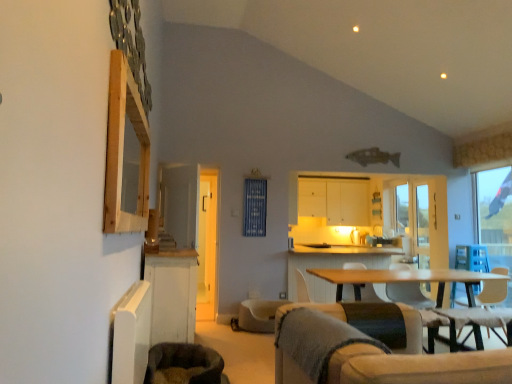
Question: Is white wood cabinet at lower left, positioned as the second cabinetry in top-to-bottom order, turned away from light brown wooden table at center?

Choices:
 (A) yes
 (B) no

Answer: (B)

Question: Would you say white wood cabinet at lower left, the 1th cabinetry positioned from the bottom, is outside light brown wooden table at center?

Choices:
 (A) no
 (B) yes

Answer: (B)

Question: Can you confirm if white wood cabinet at lower left, the first cabinetry positioned from the front, is shorter than light brown wooden table at center?

Choices:
 (A) yes
 (B) no

Answer: (B)

Question: Can you confirm if white wood cabinet at lower left, the 2th cabinetry viewed from the back, is positioned to the right of light brown wooden table at center?

Choices:
 (A) no
 (B) yes

Answer: (A)

Question: Does white wood cabinet at lower left, the 1th cabinetry positioned from the bottom, have a greater width compared to light brown wooden table at center?

Choices:
 (A) no
 (B) yes

Answer: (A)

Question: In the image, is transparent glass window at right on the left side or the right side of white matte cabinet at upper center, which is the first cabinetry from back to front?

Choices:
 (A) right
 (B) left

Answer: (A)

Question: In the image, is transparent glass window at right positioned in front of or behind white matte cabinet at upper center, which appears as the first cabinetry when viewed from the top?

Choices:
 (A) behind
 (B) front

Answer: (B)

Question: Does point (494, 231) appear closer or farther from the camera than point (348, 198)?

Choices:
 (A) closer
 (B) farther

Answer: (B)

Question: Looking at their shapes, would you say transparent glass window at right is wider or thinner than white matte cabinet at upper center, placed as the second cabinetry when sorted from front to back?

Choices:
 (A) wide
 (B) thin

Answer: (B)

Question: Based on their sizes in the image, would you say white fabric armchair at center is bigger or smaller than blue fabric curtain at center?

Choices:
 (A) big
 (B) small

Answer: (A)

Question: Is point (297, 294) closer or farther from the camera than point (249, 220)?

Choices:
 (A) closer
 (B) farther

Answer: (A)

Question: From the image's perspective, is white fabric armchair at center above or below blue fabric curtain at center?

Choices:
 (A) below
 (B) above

Answer: (A)

Question: From a real-world perspective, is white fabric armchair at center positioned above or below blue fabric curtain at center?

Choices:
 (A) above
 (B) below

Answer: (B)

Question: Visually, is light brown wooden table at center positioned to the left or to the right of beige fabric swivel chair at center, which appears as the 2th swivel chair when viewed from the front?

Choices:
 (A) left
 (B) right

Answer: (B)

Question: Considering the positions of light brown wooden table at center and beige fabric swivel chair at center, which appears as the 1th swivel chair when viewed from the back, in the image, is light brown wooden table at center bigger or smaller than beige fabric swivel chair at center, which appears as the 1th swivel chair when viewed from the back,?

Choices:
 (A) small
 (B) big

Answer: (B)